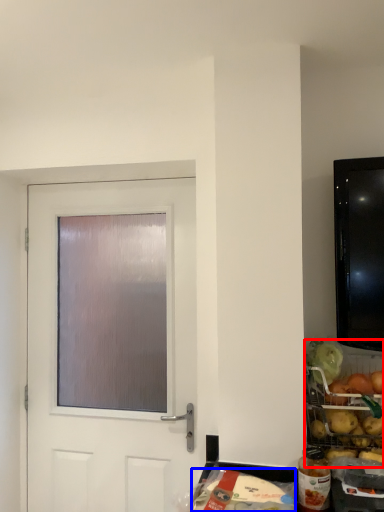
Question: Which point is closer to the camera, food (highlighted by a red box) or food (highlighted by a blue box)?

Choices:
 (A) food
 (B) food

Answer: (B)